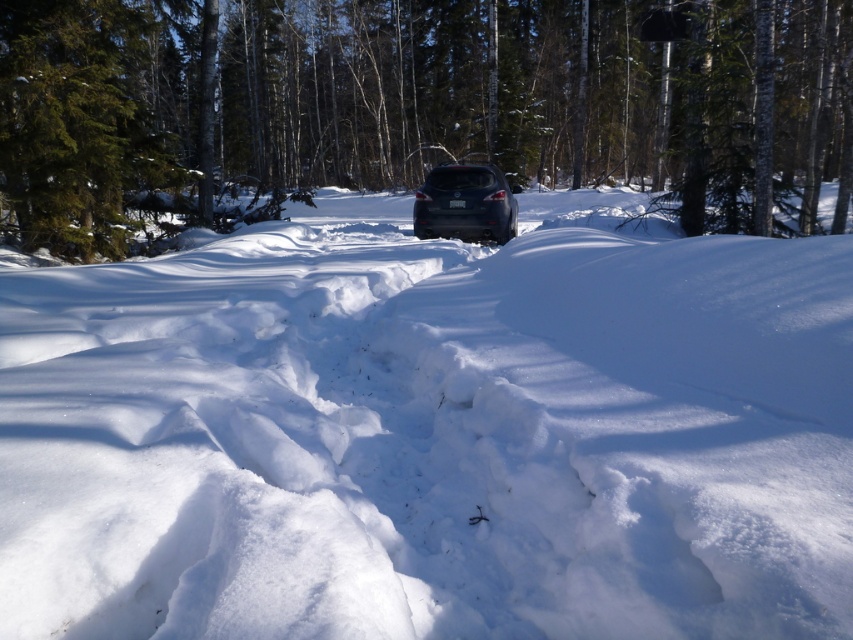
Is white fluffy snow at center closer to camera compared to satin dark gray suv at center?

Yes, it is.

Which is above, white fluffy snow at center or satin dark gray suv at center?

satin dark gray suv at center is above.

Is point (512, 323) positioned after point (474, 221)?

No, (512, 323) is in front of (474, 221).

This screenshot has height=640, width=853. What are the coordinates of `white fluffy snow at center` in the screenshot? It's located at (430, 432).